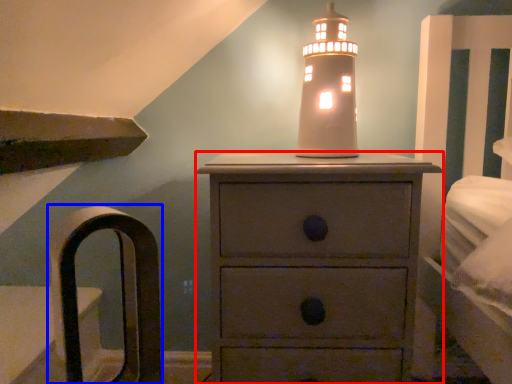
Question: Which point is closer to the camera, chest of drawers (highlighted by a red box) or armchair (highlighted by a blue box)?

Choices:
 (A) chest of drawers
 (B) armchair

Answer: (B)